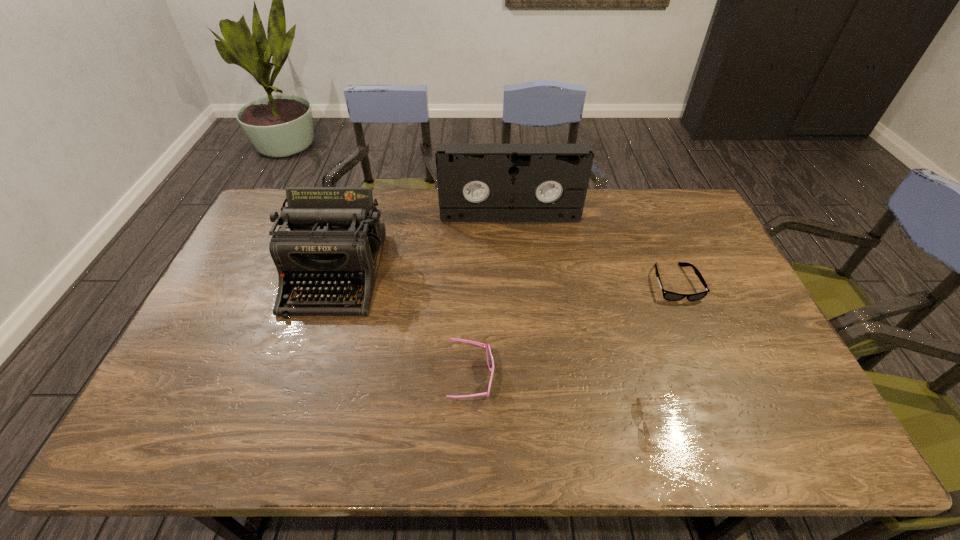
Where is `free spot between the rightmost sunglasses and the typewriter`? This screenshot has height=540, width=960. free spot between the rightmost sunglasses and the typewriter is located at coordinates (505, 278).

Locate an element on the screen. free point between the fourth shortest object and the videotape is located at coordinates (422, 245).

Locate an element on the screen. vacant space in between the third shortest object and the rightmost sunglasses is located at coordinates (573, 330).

Find the location of a particular element. The height and width of the screenshot is (540, 960). free area in between the farthest object and the second object from right to left is located at coordinates (585, 320).

You are a GUI agent. You are given a task and a screenshot of the screen. Output one action in this format:
    pyautogui.click(x=<x>, y=<y>)
    Task: Click on the vacant region between the shortest object and the videotape
    
    Given the screenshot: What is the action you would take?
    pyautogui.click(x=585, y=320)

Locate which object ranks third in proximity to the typewriter. Please provide its 2D coordinates. Your answer should be formatted as a tuple, i.e. [(x, y)], where the tuple contains the x and y coordinates of a point satisfying the conditions above.

[(639, 406)]

Select which object is the second closest to the second sunglasses from left to right. Please provide its 2D coordinates. Your answer should be formatted as a tuple, i.e. [(x, y)], where the tuple contains the x and y coordinates of a point satisfying the conditions above.

[(490, 361)]

Identify which sunglasses is located as the second nearest to the rightmost object. Please provide its 2D coordinates. Your answer should be formatted as a tuple, i.e. [(x, y)], where the tuple contains the x and y coordinates of a point satisfying the conditions above.

[(490, 361)]

Where is `the closest sunglasses to the second shortest sunglasses`? the closest sunglasses to the second shortest sunglasses is located at coordinates (639, 406).

Where is `free region that satisfies the following two spatial constraints: 1. on the side of the farthest object with visible spindles; 2. on the front-facing side of the leftmost sunglasses`? This screenshot has width=960, height=540. free region that satisfies the following two spatial constraints: 1. on the side of the farthest object with visible spindles; 2. on the front-facing side of the leftmost sunglasses is located at coordinates (522, 378).